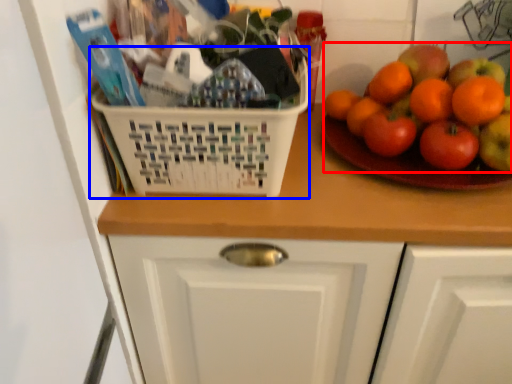
Question: Which object is closer to the camera taking this photo, fruit (highlighted by a red box) or basket (highlighted by a blue box)?

Choices:
 (A) fruit
 (B) basket

Answer: (B)